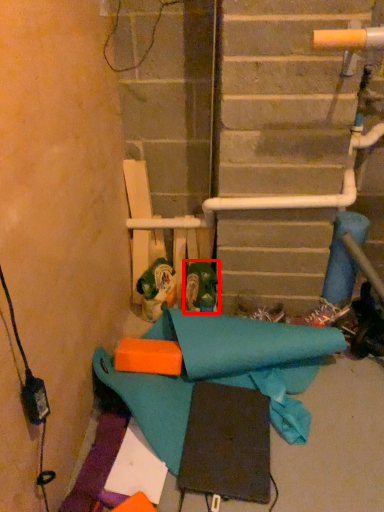
Question: From the image's perspective, what is the correct spatial positioning of footwear (annotated by the red box) in reference to toy?

Choices:
 (A) above
 (B) below

Answer: (B)